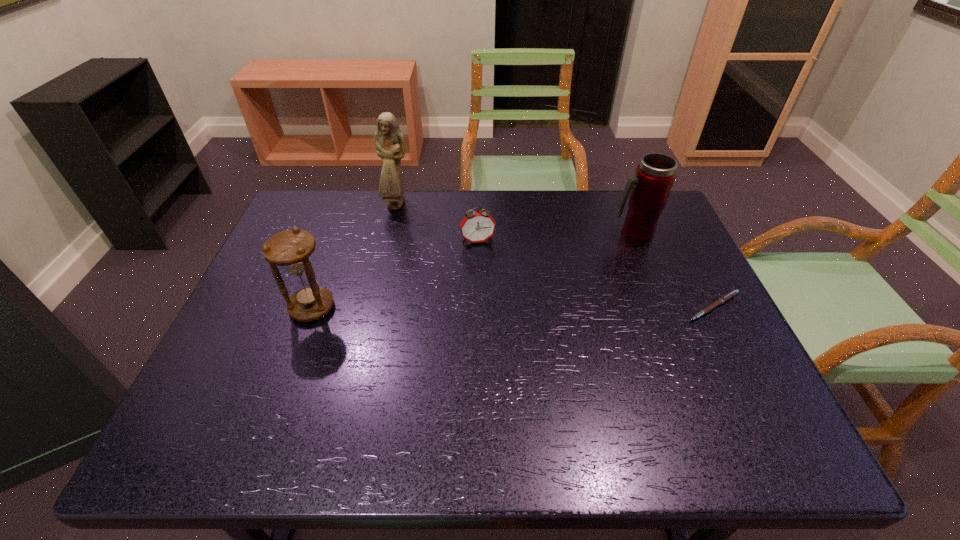
Locate an element on the screen. hourglass is located at coordinates (290, 249).

Locate an element on the screen. Image resolution: width=960 pixels, height=540 pixels. the shortest object is located at coordinates (726, 297).

Where is `thermos bottle`? The image size is (960, 540). thermos bottle is located at coordinates (649, 189).

Where is `the fourth tallest object`? This screenshot has height=540, width=960. the fourth tallest object is located at coordinates (479, 226).

Find the location of a particular element. the third object from right to left is located at coordinates (479, 226).

The width and height of the screenshot is (960, 540). What are the coordinates of `figurine` in the screenshot? It's located at (389, 142).

Identify the location of the farthest object. This screenshot has height=540, width=960. (389, 142).

The width and height of the screenshot is (960, 540). In order to click on free space located on the right of the hourglass in this screenshot , I will do `click(454, 308)`.

This screenshot has width=960, height=540. Find the location of `free spot located at the nib of the shortest object`. free spot located at the nib of the shortest object is located at coordinates (735, 349).

Image resolution: width=960 pixels, height=540 pixels. I want to click on free space located 0.390m on the side with the handle of the thermos bottle, so click(x=551, y=322).